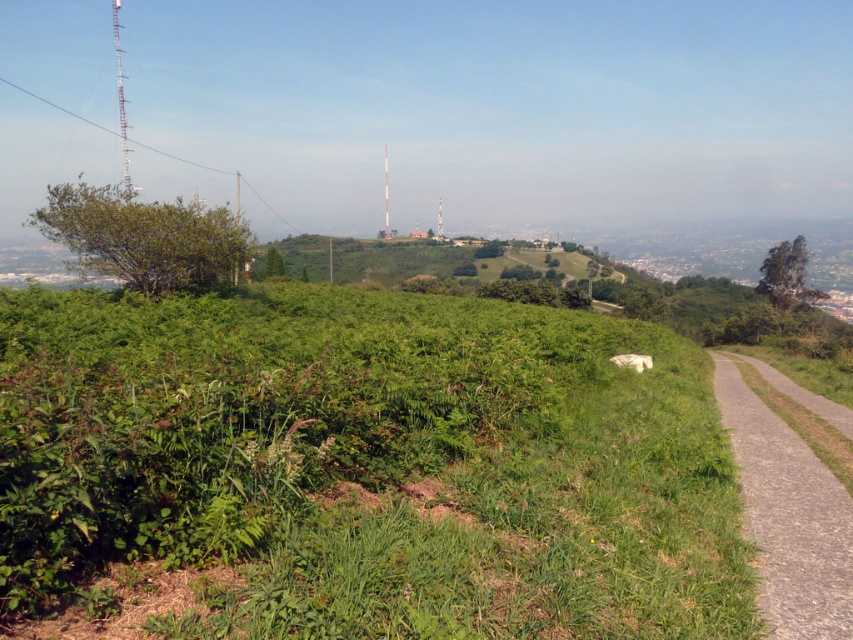
You are a hiker who wants to walk from the bottom left corner of the image to the red communication towers on the hill. You see the green leafy grass at center and the gray gravel path at right. Which path should you take to stay on the trail designated for hikers?

The gray gravel path at right is the designated trail for hikers, so you should take the gray gravel path at right instead of the green leafy grass at center.

You are a gardener planning to mow the green leafy grass at center and the gray gravel path at right. Which area requires a wider mower to handle its width?

The green leafy grass at center requires a wider mower since its width is larger than the gray gravel path at right.

You are a hiker standing at the bottom of the hill. You see the green leafy grass at center and the gray gravel path at right. Which one is higher in elevation?

The green leafy grass at center is located above the gray gravel path at right, so it has a higher elevation.